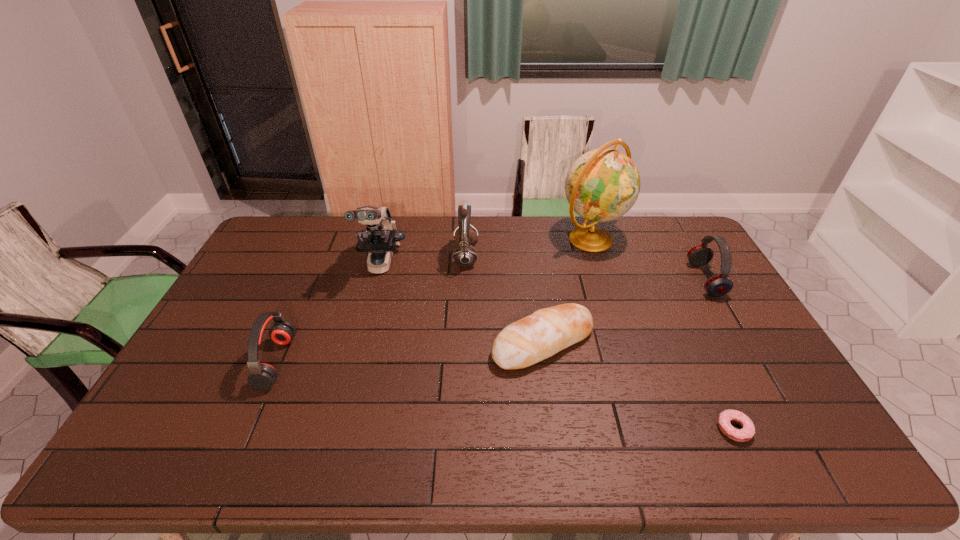
Image resolution: width=960 pixels, height=540 pixels. I want to click on free space between the rightmost earphone and the tallest object, so click(648, 259).

Select which object is the sixth closest to the sixth shortest object. Please provide its 2D coordinates. Your answer should be formatted as a tuple, i.e. [(x, y)], where the tuple contains the x and y coordinates of a point satisfying the conditions above.

[(718, 285)]

Locate an element on the screen. The width and height of the screenshot is (960, 540). the fifth closest object to the globe is located at coordinates (745, 434).

Identify which earphone is the second nearest to the sixth object from right to left. Please provide its 2D coordinates. Your answer should be formatted as a tuple, i.e. [(x, y)], where the tuple contains the x and y coordinates of a point satisfying the conditions above.

[(262, 376)]

Where is `earphone that can be found as the second closest to the rightmost earphone`? earphone that can be found as the second closest to the rightmost earphone is located at coordinates (262, 376).

You are a GUI agent. You are given a task and a screenshot of the screen. Output one action in this format:
    pyautogui.click(x=<x>, y=<y>)
    Task: Click on the vacant area in the image that satisfies the following two spatial constraints: 1. through the eyepieces of the microscope; 2. on the left side of the shortest object
    The width and height of the screenshot is (960, 540).
    Given the screenshot: What is the action you would take?
    pyautogui.click(x=336, y=429)

Locate an element on the screen. Image resolution: width=960 pixels, height=540 pixels. blank area in the image that satisfies the following two spatial constraints: 1. on the ear pads of the fifth object from right to left; 2. on the left side of the shortest object is located at coordinates (459, 429).

This screenshot has width=960, height=540. In order to click on vacant area in the image that satisfies the following two spatial constraints: 1. on the ear cups of the leftmost earphone; 2. on the back side of the second object from right to left in this screenshot , I will do `click(248, 429)`.

The image size is (960, 540). In order to click on free region that satisfies the following two spatial constraints: 1. on the front side of the tallest object; 2. on the ear cups of the nearest earphone in this screenshot , I will do `click(631, 362)`.

The image size is (960, 540). I want to click on free location that satisfies the following two spatial constraints: 1. on the front side of the globe; 2. on the ear pads of the third tallest object, so click(x=597, y=257).